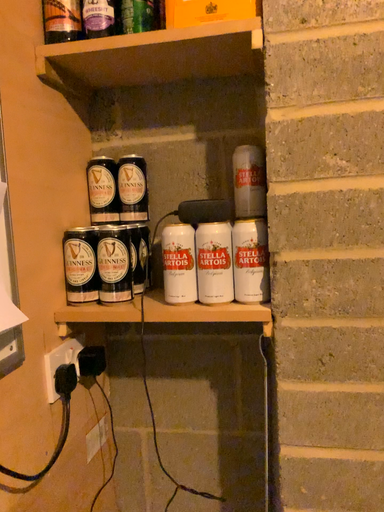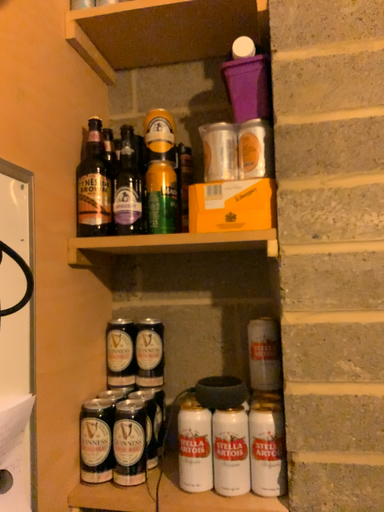
Question: Which way did the camera rotate in the video?

Choices:
 (A) rotated upward
 (B) rotated downward

Answer: (A)